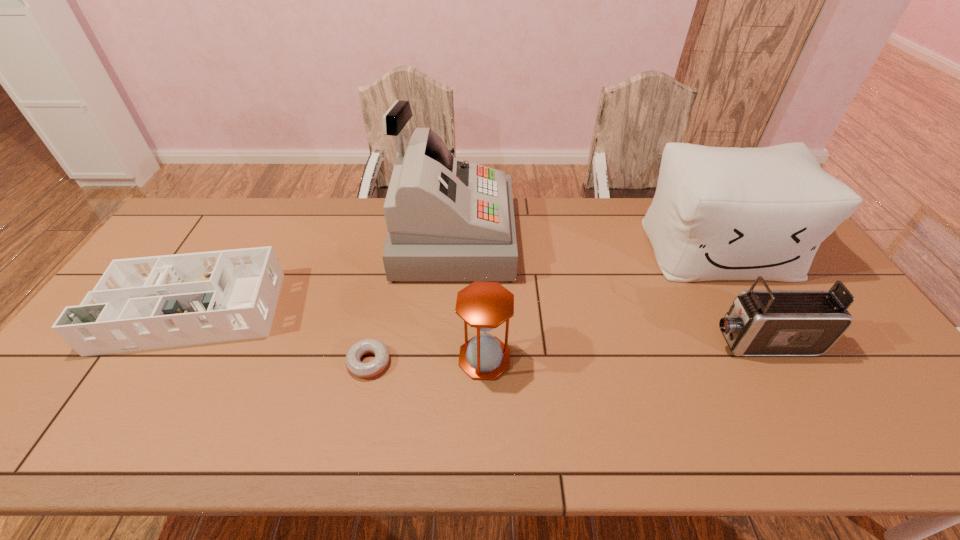
You are a GUI agent. You are given a task and a screenshot of the screen. Output one action in this format:
    pyautogui.click(x=<x>, y=<y>)
    Task: Click on the free spot located 0.250m at the lens of the camcorder
    Image resolution: width=960 pixels, height=540 pixels.
    Given the screenshot: What is the action you would take?
    pyautogui.click(x=612, y=342)

This screenshot has height=540, width=960. Find the location of `free location located at the lens of the camcorder`. free location located at the lens of the camcorder is located at coordinates tap(676, 342).

Where is `vacant area situated on the left of the hourglass`? This screenshot has height=540, width=960. vacant area situated on the left of the hourglass is located at coordinates (392, 359).

Where is `vacant space located on the right of the leftmost object`? The width and height of the screenshot is (960, 540). vacant space located on the right of the leftmost object is located at coordinates (303, 305).

The width and height of the screenshot is (960, 540). What are the coordinates of `vacant position located on the left of the doughnut` in the screenshot? It's located at click(197, 362).

The width and height of the screenshot is (960, 540). I want to click on cash register present at the far edge, so click(x=448, y=219).

You are a GUI agent. You are given a task and a screenshot of the screen. Output one action in this format:
    pyautogui.click(x=<x>, y=<y>)
    Task: Click on the cushion that is at the far edge
    The image size is (960, 540).
    Given the screenshot: What is the action you would take?
    pyautogui.click(x=718, y=213)

The image size is (960, 540). In order to click on object at the left edge in this screenshot , I will do `click(143, 303)`.

I want to click on cushion situated at the right edge, so click(x=718, y=213).

Locate an element on the screen. camcorder present at the right edge is located at coordinates (768, 322).